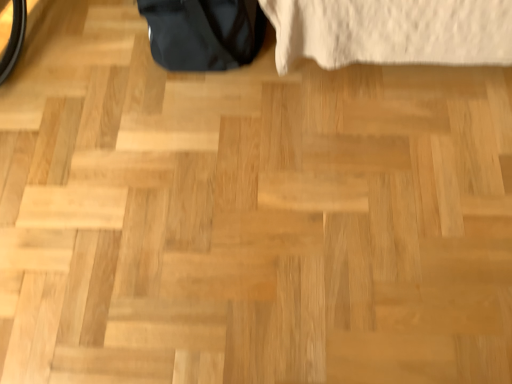
The width and height of the screenshot is (512, 384). What do you see at coordinates (203, 33) in the screenshot?
I see `glossy black bag at upper left` at bounding box center [203, 33].

In order to face glossy black bag at upper left, should I rotate leftwards or rightwards?

To align with it, rotate left about 7.701°.

Image resolution: width=512 pixels, height=384 pixels. I want to click on glossy black bag at upper left, so click(203, 33).

Locate an element on the screen. The height and width of the screenshot is (384, 512). glossy black bag at upper left is located at coordinates pos(203,33).